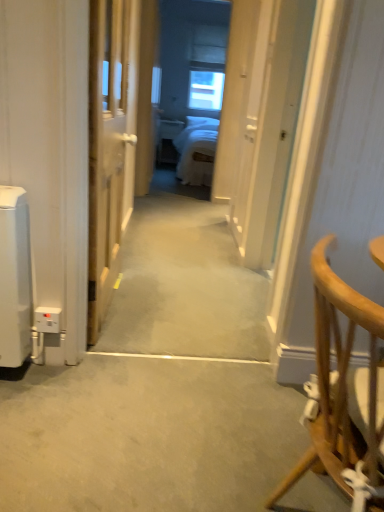
Question: From a real-world perspective, does gray carpet at center, which ranks as the 1th path in front-to-back order, stand above transparent glass window at center?

Choices:
 (A) no
 (B) yes

Answer: (A)

Question: From the image's perspective, is gray carpet at center, which ranks as the 1th path in front-to-back order, located above transparent glass window at center?

Choices:
 (A) yes
 (B) no

Answer: (B)

Question: Is gray carpet at center, which ranks as the 1th path in front-to-back order, outside of transparent glass window at center?

Choices:
 (A) yes
 (B) no

Answer: (A)

Question: Is gray carpet at center, acting as the first path starting from the bottom, in contact with transparent glass window at center?

Choices:
 (A) no
 (B) yes

Answer: (A)

Question: Is gray carpet at center, which ranks as the second path in top-to-bottom order, bigger than transparent glass window at center?

Choices:
 (A) yes
 (B) no

Answer: (A)

Question: Would you say wooden door at center is to the left or to the right of carpeted hallway at center, placed as the first path when sorted from back to front, in the picture?

Choices:
 (A) left
 (B) right

Answer: (A)

Question: Is wooden door at center in front of or behind carpeted hallway at center, the second path viewed from the front, in the image?

Choices:
 (A) front
 (B) behind

Answer: (A)

Question: From the image's perspective, is wooden door at center above or below carpeted hallway at center, the 1th path when ordered from top to bottom?

Choices:
 (A) below
 (B) above

Answer: (B)

Question: Is wooden door at center taller or shorter than carpeted hallway at center, the 1th path when ordered from top to bottom?

Choices:
 (A) tall
 (B) short

Answer: (A)

Question: Is light brown wooden chair at right in front of or behind wooden door at center in the image?

Choices:
 (A) front
 (B) behind

Answer: (A)

Question: Looking at their shapes, would you say light brown wooden chair at right is wider or thinner than wooden door at center?

Choices:
 (A) thin
 (B) wide

Answer: (B)

Question: From the image's perspective, relative to wooden door at center, is light brown wooden chair at right above or below?

Choices:
 (A) above
 (B) below

Answer: (B)

Question: From a real-world perspective, is light brown wooden chair at right positioned above or below wooden door at center?

Choices:
 (A) below
 (B) above

Answer: (A)

Question: Is transparent glass window at center bigger or smaller than wooden door at center?

Choices:
 (A) big
 (B) small

Answer: (B)

Question: Does point (208, 110) appear closer or farther from the camera than point (94, 136)?

Choices:
 (A) farther
 (B) closer

Answer: (A)